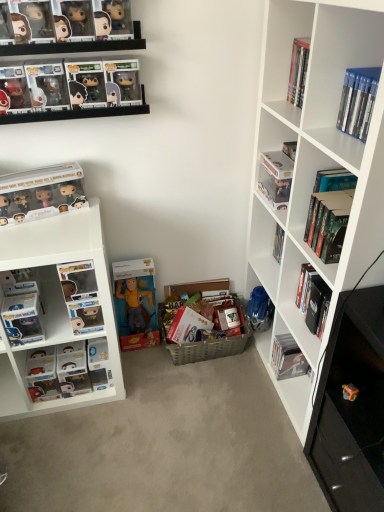
Image resolution: width=384 pixels, height=512 pixels. Identify the location of vacant area located to the right-hand side of white plastic shelves at left. (162, 399).